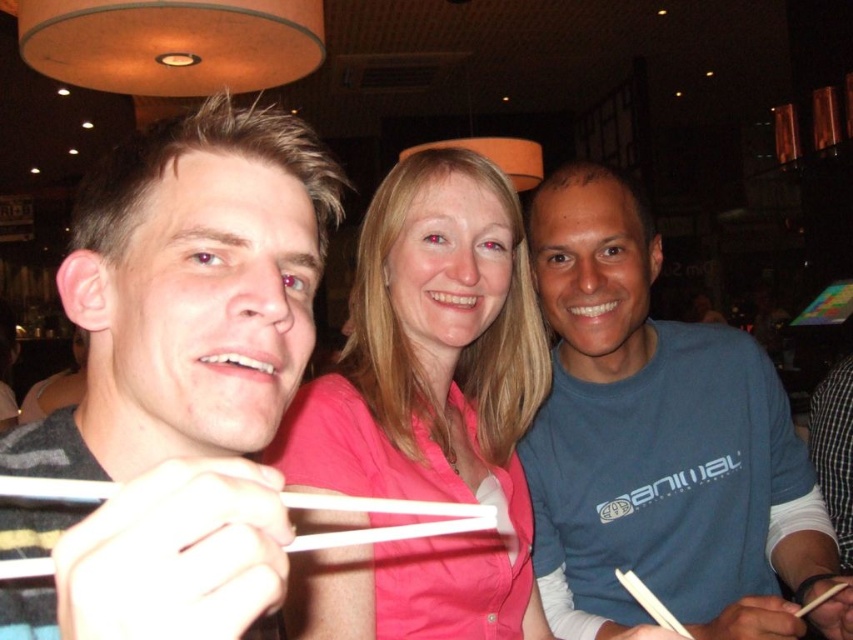
Looking at this image, you are a waiter in a restaurant and need to deliver a drink to the table. The pink fabric shirt at center is in front of the white plastic chopstick at lower right. Which object should you avoid bumping into when placing the drink?

You should avoid bumping into the pink fabric shirt at center because it is in front of the white plastic chopstick at lower right and closer to where you would place the drink.

You are a waiter in a restaurant and need to deliver a dessert plate that is 16 inches wide. The plate must be placed between the pink fabric shirt at center and the wooden chopstick at lower right. Can the dessert plate fit in the space between them?

The distance between the pink fabric shirt at center and the wooden chopstick at lower right is 18.00 inches. Since the dessert plate is 16 inches wide, it can fit in the space between them as there is enough room.

You are a photographer trying to capture a candid shot of the group. You notice the pink fabric shirt at center and the wooden chopstick at lower right. Which object should you focus on first if you want to ensure both are in focus without adjusting the camera settings?

The pink fabric shirt at center is taller than the wooden chopstick at lower right, so focusing on the pink fabric shirt at center first will ensure both are within the depth of field since it is closer to the camera.